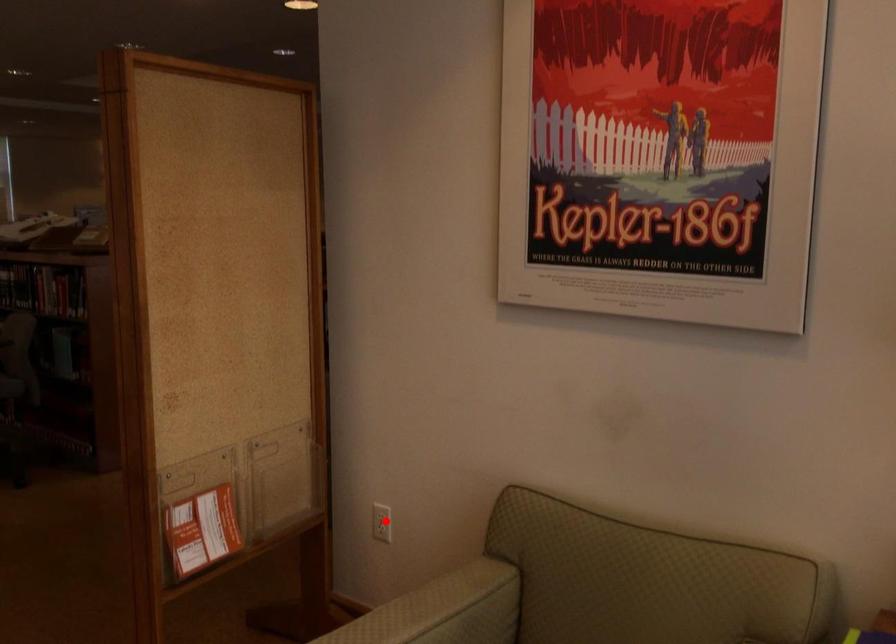
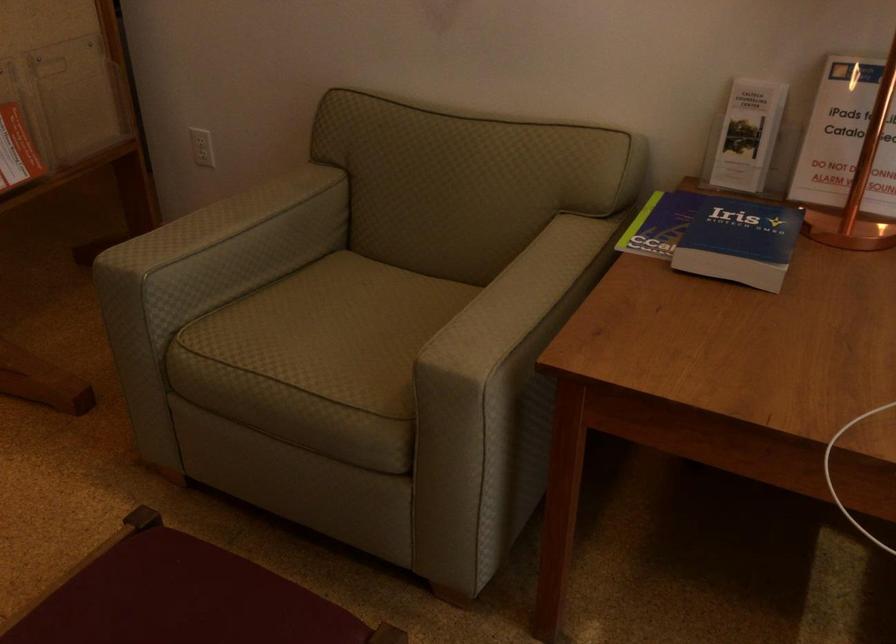
Locate, in the second image, the point that corresponds to the highlighted location in the first image.

(202, 147)